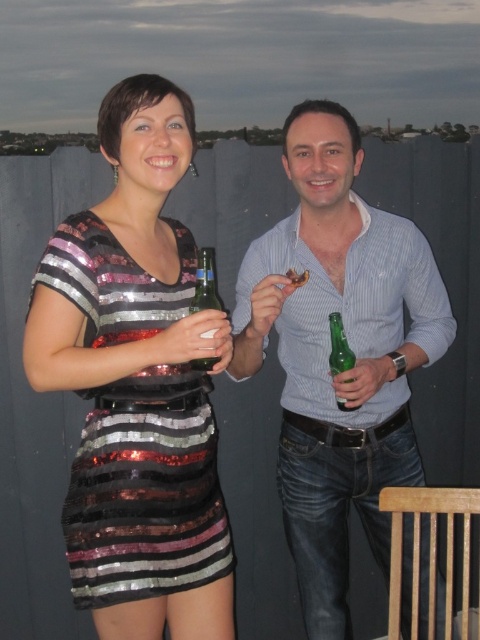
Measure the distance between point (191,308) and camera.

Point (191,308) and camera are 1.61 meters apart from each other.

Does green glass beer bottle at center appear over green glass bottle at right?

Indeed, green glass beer bottle at center is positioned over green glass bottle at right.

What are the coordinates of `green glass beer bottle at center` in the screenshot? It's located at (204, 282).

Where is `green glass beer bottle at center`? This screenshot has width=480, height=640. green glass beer bottle at center is located at coordinates (204, 282).

Measure the distance between blue striped shirt at center and shiny sequined dress at left.

14.18 inches

Who is positioned more to the left, blue striped shirt at center or shiny sequined dress at left?

Positioned to the left is shiny sequined dress at left.

Is point (345, 618) positioned behind point (118, 273)?

Yes, point (345, 618) is behind point (118, 273).

Locate an element on the screen. blue striped shirt at center is located at coordinates (328, 353).

Based on the photo, can you confirm if blue striped shirt at center is positioned to the right of green glass beer bottle at center?

Indeed, blue striped shirt at center is positioned on the right side of green glass beer bottle at center.

Which is in front, point (396, 250) or point (219, 305)?

Point (219, 305)

Find the location of `blue striped shirt at center`. blue striped shirt at center is located at coordinates (328, 353).